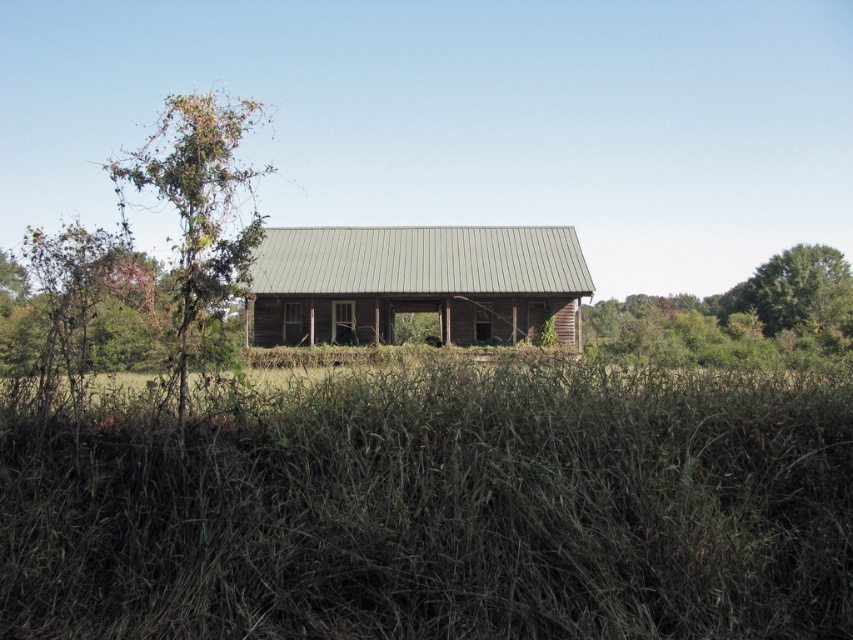
Question: Is weathered wood hut at center positioned at the back of green leafy tree at left?

Choices:
 (A) no
 (B) yes

Answer: (B)

Question: Considering the relative positions of green rough grass at center and green leafy tree at upper right in the image provided, where is green rough grass at center located with respect to green leafy tree at upper right?

Choices:
 (A) left
 (B) right

Answer: (A)

Question: Which object is positioned farthest from the green leafy tree at upper right?

Choices:
 (A) green leafy tree at left
 (B) green rough grass at center

Answer: (B)

Question: Which point is closer to the camera taking this photo?

Choices:
 (A) (248, 128)
 (B) (196, 534)

Answer: (B)

Question: From the image, what is the correct spatial relationship of green rough grass at center in relation to green leafy tree at upper right?

Choices:
 (A) below
 (B) above

Answer: (A)

Question: Estimate the real-world distances between objects in this image. Which object is farther from the weathered wood hut at center?

Choices:
 (A) green rough grass at center
 (B) green leafy tree at right

Answer: (A)